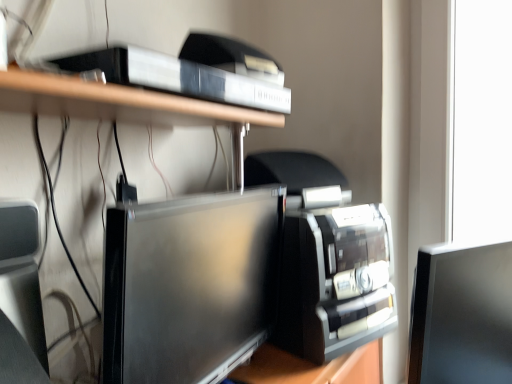
Question: Considering the positions of satin black monitor at center, which is the 2th computer monitor in right-to-left order, and satin black monitor at right, the second computer monitor in the left-to-right sequence, in the image, is satin black monitor at center, which is the 2th computer monitor in right-to-left order, wider or thinner than satin black monitor at right, the second computer monitor in the left-to-right sequence,?

Choices:
 (A) thin
 (B) wide

Answer: (B)

Question: From the image's perspective, is satin black monitor at center, the 1th computer monitor in the left-to-right sequence, above or below satin black monitor at right, which appears as the 1th computer monitor when viewed from the right?

Choices:
 (A) below
 (B) above

Answer: (B)

Question: Which of these objects is positioned farthest from the white plastic shelf at upper center?

Choices:
 (A) satin black monitor at right, the second computer monitor in the left-to-right sequence
 (B) satin black monitor at center, which is the 2th computer monitor in right-to-left order

Answer: (A)

Question: Which object is the farthest from the satin black monitor at center, the 1th computer monitor in the left-to-right sequence?

Choices:
 (A) white plastic shelf at upper center
 (B) satin black monitor at right, which appears as the 1th computer monitor when viewed from the right

Answer: (B)